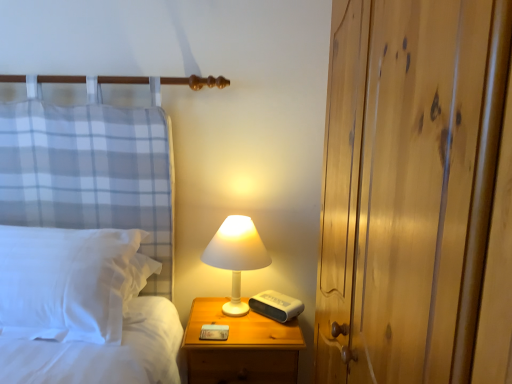
Identify the location of free space underneath white matte lamp at center (from a real-world perspective). The width and height of the screenshot is (512, 384). (230, 311).